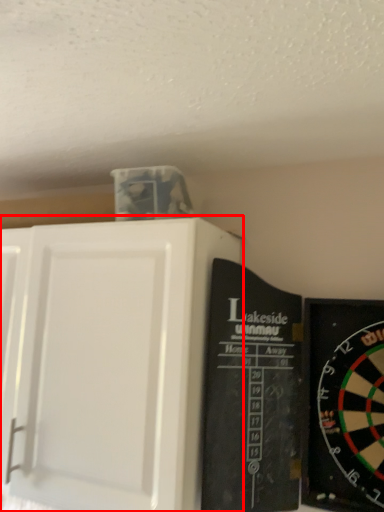
Question: From the image's perspective, what is the correct spatial positioning of cupboard (annotated by the red box) in reference to bulletin board?

Choices:
 (A) below
 (B) above

Answer: (B)